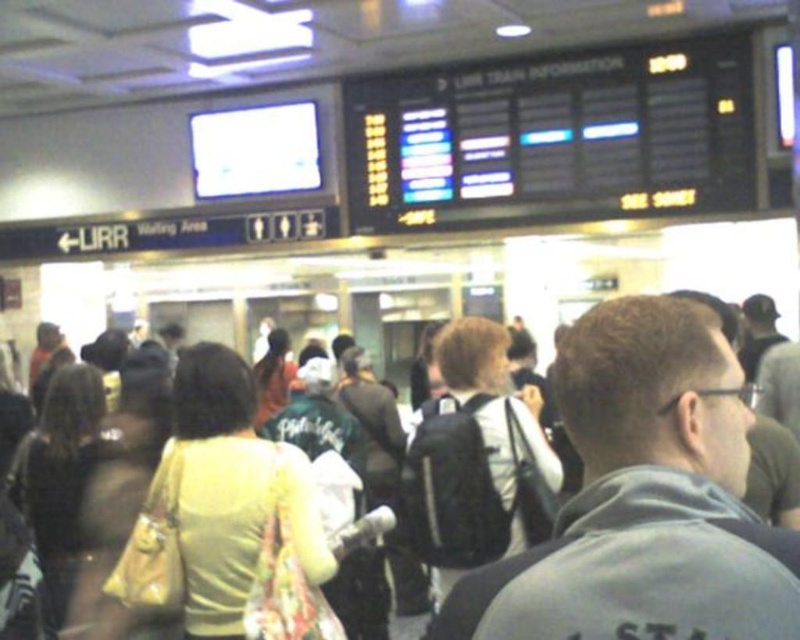
Who is positioned more to the right, black backpack at center or light beige fabric purse at left?

Positioned to the right is black backpack at center.

Does black backpack at center have a greater height compared to light beige fabric purse at left?

Yes, black backpack at center is taller than light beige fabric purse at left.

At what (x,y) coordinates should I click in order to perform the action: click on black backpack at center. Please return your answer as a coordinate pair (x, y). The height and width of the screenshot is (640, 800). Looking at the image, I should click on (470, 458).

Is light yellow fabric purse at center to the left of black backpack at center from the viewer's perspective?

Correct, you'll find light yellow fabric purse at center to the left of black backpack at center.

Describe the element at coordinates (218, 502) in the screenshot. I see `light yellow fabric purse at center` at that location.

Find the location of a particular element. This screenshot has height=640, width=800. light yellow fabric purse at center is located at coordinates (218, 502).

Locate an element on the screen. This screenshot has width=800, height=640. light yellow fabric purse at center is located at coordinates (218, 502).

Can you confirm if gray fabric backpack at center is wider than light yellow fabric purse at center?

Incorrect, gray fabric backpack at center's width does not surpass light yellow fabric purse at center's.

Measure the distance between gray fabric backpack at center and light yellow fabric purse at center.

Result: 5.43 feet

Is point (632, 474) more distant than point (165, 586)?

No, it is not.

Image resolution: width=800 pixels, height=640 pixels. What are the coordinates of `gray fabric backpack at center` in the screenshot? It's located at (644, 499).